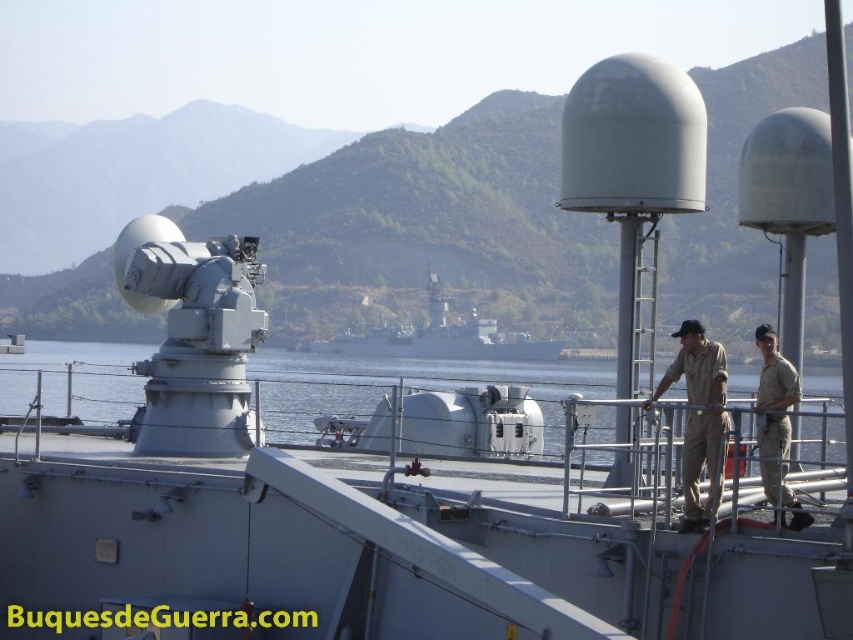
Describe the element at coordinates (405, 385) in the screenshot. This screenshot has width=853, height=640. I see `clear blue water at center` at that location.

Between clear blue water at center and khaki uniform at center, which one appears on the right side from the viewer's perspective?

clear blue water at center is more to the right.

Does point (108, 352) come behind point (781, 492)?

Yes, point (108, 352) is behind point (781, 492).

Identify the location of clear blue water at center. This screenshot has height=640, width=853. (405, 385).

Can you confirm if khaki uniform at center is positioned to the left of metallic gray ship at center?

In fact, khaki uniform at center is to the right of metallic gray ship at center.

What do you see at coordinates (698, 417) in the screenshot?
I see `khaki uniform at center` at bounding box center [698, 417].

Is point (706, 522) positioned in front of point (387, 342)?

Yes, it is in front of point (387, 342).

Where is `khaki uniform at center`? The width and height of the screenshot is (853, 640). khaki uniform at center is located at coordinates (698, 417).

Where is `clear blue water at center`? clear blue water at center is located at coordinates (405, 385).

Is clear blue water at center closer to the viewer compared to tan uniform at right?

No.

Where is `clear blue water at center`? This screenshot has height=640, width=853. clear blue water at center is located at coordinates (405, 385).